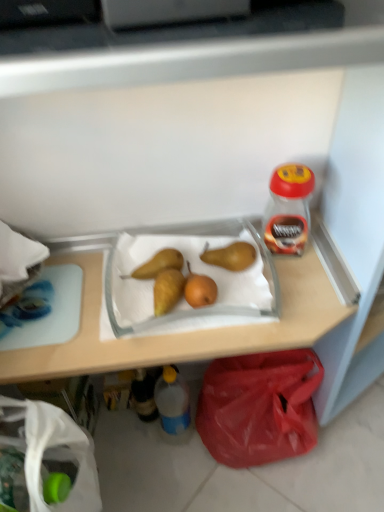
Identify the location of vacant space situated above yellow matte pears at center (from a real-world perspective). (183, 298).